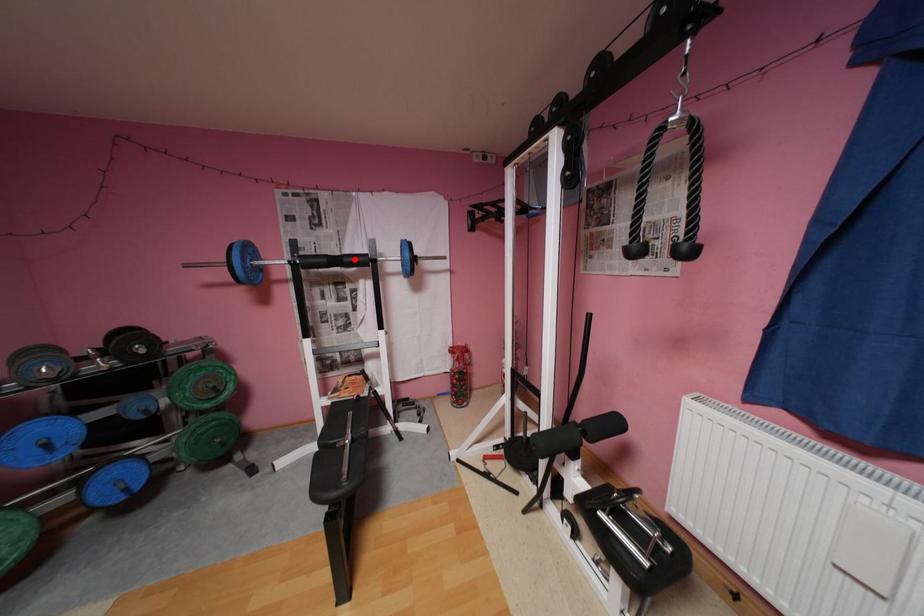
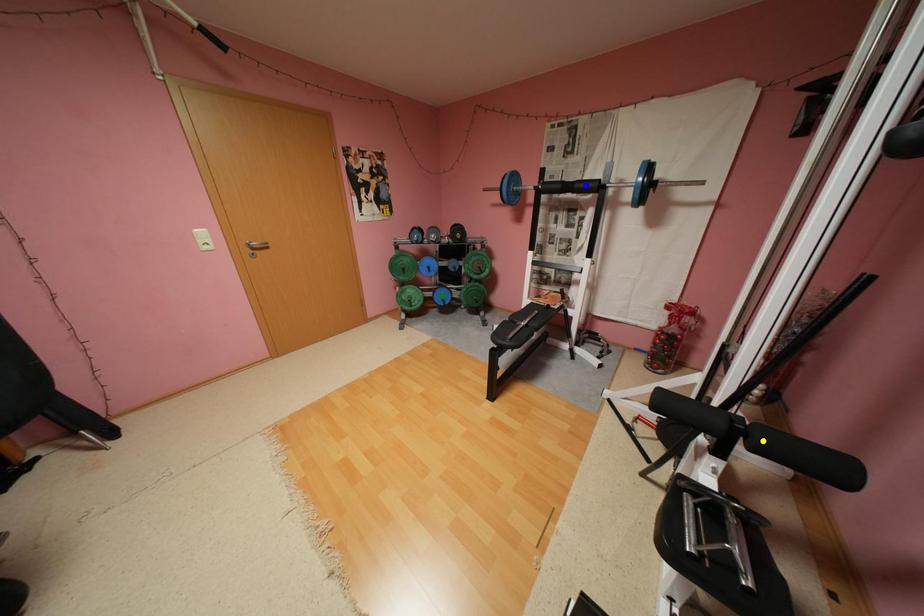
Question: I am providing you with two images of the same scene from different viewpoints. A red point is marked on the first image. You are given multiple points on the second image. Which spot in image 2 lines up with the point in image 1?

Choices:
 (A) blue point
 (B) green point
 (C) yellow point

Answer: (A)